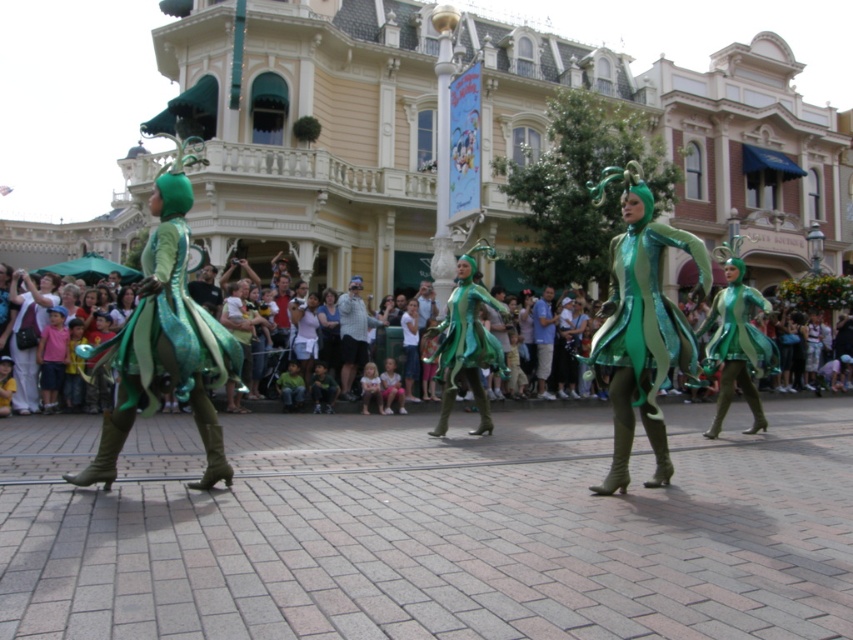
Is matte white blouse at center to the left of matte green costumes at center from the viewer's perspective?

In fact, matte white blouse at center is to the right of matte green costumes at center.

Is point (297, 342) positioned in front of point (509, 355)?

Yes, point (297, 342) is closer to viewer.

Find the location of a particular element. The height and width of the screenshot is (640, 853). matte white blouse at center is located at coordinates (305, 333).

Between green metallic dress at center and green matte dress at center, which one has less height?

green matte dress at center is shorter.

Looking at this image, who is more distant from viewer, (619, 204) or (476, 301)?

Positioned behind is point (619, 204).

This screenshot has width=853, height=640. I want to click on green metallic dress at center, so click(x=641, y=324).

Can you confirm if green shiny dress at left is smaller than matte white blouse at center?

No, green shiny dress at left is not smaller than matte white blouse at center.

Looking at this image, does green shiny dress at left appear on the right side of matte white blouse at center?

No, green shiny dress at left is not to the right of matte white blouse at center.

Between point (216, 326) and point (311, 355), which one is positioned in front?

Point (216, 326) is in front.

Identify the location of green shiny dress at left. This screenshot has height=640, width=853. (165, 337).